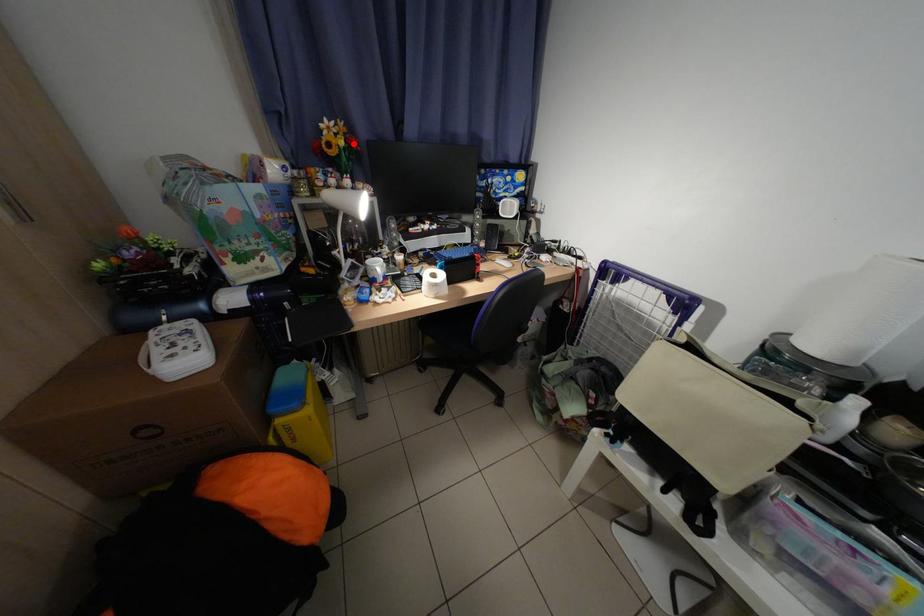
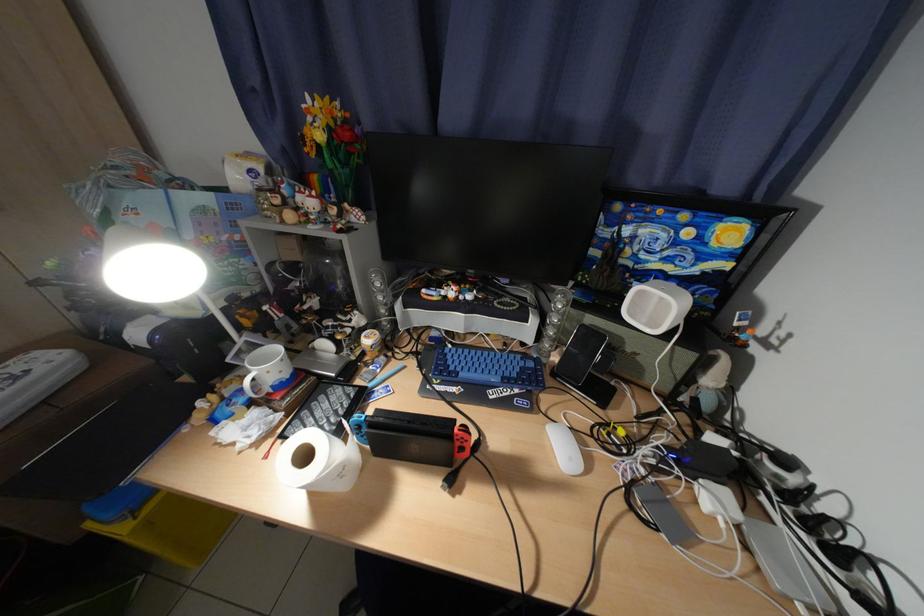
Locate, in the second image, the point that corresponds to the highlighted location in the first image.

(331, 138)